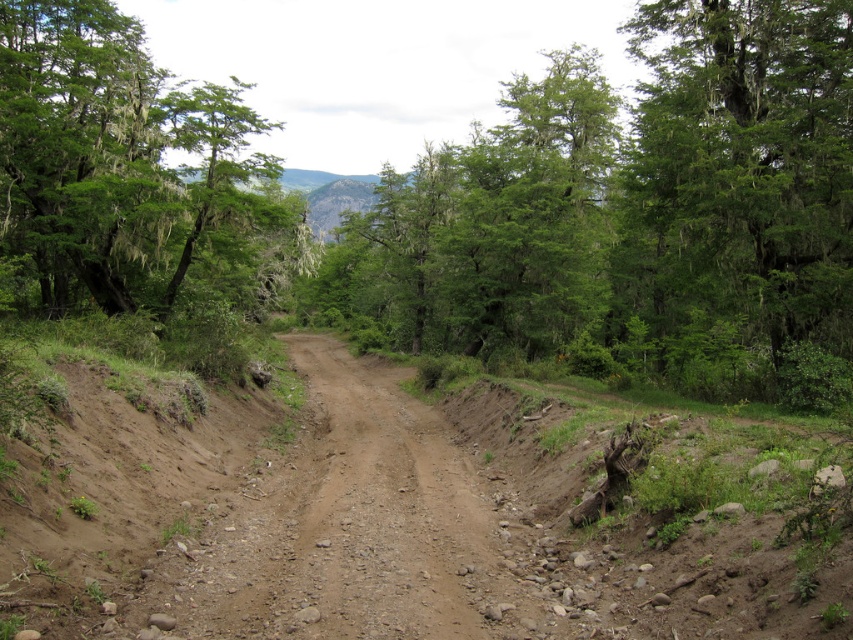
You are driving a car that is 2 meters wide. You come across a narrow dirt road in a forest. The road has a green leafy tree at upper center and a brown gravelly dirt track at center. Can your car pass through the road without hitting the tree?

The green leafy tree at upper center is larger than the brown gravelly dirt track at center, so the tree may block the road. However, since the tree is at the upper center and the track is at the center, the car should stay on the dirt track and avoid the tree to pass safely.

You are navigating a drone through the forest depicted in the image. You need to fly the drone from the starting point near the road to a safe landing spot. The drone has a GPS coordinate system where the bottom left corner of the image is the origin point. The green leafy tree at upper center is located at coordinates approximately 0.334 on the x axis and 0.744 on the y axis. Which direction should you fly the drone to reach the tree?

The green leafy tree at upper center is located at coordinates approximately 0.334 on the x axis and 0.744 on the y axis. To reach it, fly the drone northeast from the starting point near the road, as the tree is positioned northeast in the image.